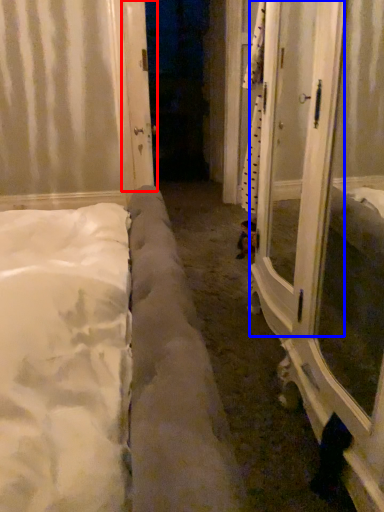
Question: Which of the following is the farthest to the observer, door (highlighted by a red box) or screen door (highlighted by a blue box)?

Choices:
 (A) door
 (B) screen door

Answer: (A)